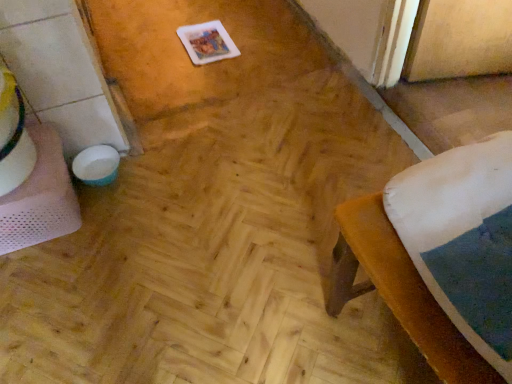
Identify the location of vacant space in front of white mesh table at left. The height and width of the screenshot is (384, 512). (49, 288).